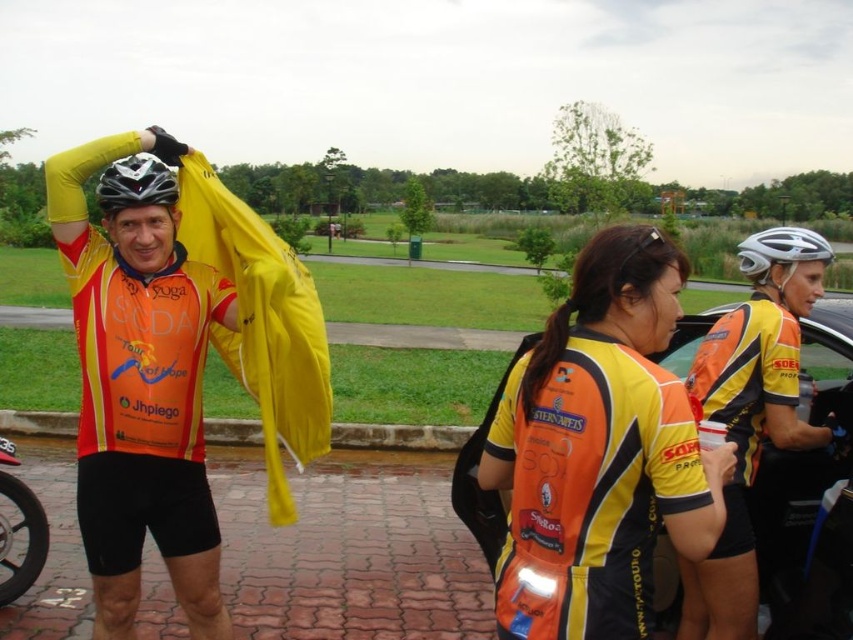
Does point (7, 582) come closer to viewer compared to point (141, 188)?

No, (7, 582) is behind (141, 188).

Can you confirm if black rubber tire at lower left is positioned above matte black helmet at upper left?

No, black rubber tire at lower left is not above matte black helmet at upper left.

Locate an element on the screen. black rubber tire at lower left is located at coordinates (26, 540).

Between yellow-orange cycling jersey at center and black rubber tire at lower left, which one is positioned higher?

yellow-orange cycling jersey at center is above.

Does yellow-orange cycling jersey at center appear on the right side of black rubber tire at lower left?

Yes, yellow-orange cycling jersey at center is to the right of black rubber tire at lower left.

At what (x,y) coordinates should I click in order to perform the action: click on yellow-orange cycling jersey at center. Please return your answer as a coordinate pair (x, y). Looking at the image, I should click on (599, 451).

Consider the image. Can you confirm if matte yellow jacket at center is bigger than orange jersey at center?

Yes, matte yellow jacket at center is bigger than orange jersey at center.

Is matte yellow jacket at center further to camera compared to orange jersey at center?

No, matte yellow jacket at center is in front of orange jersey at center.

Where is `matte yellow jacket at center`? This screenshot has height=640, width=853. matte yellow jacket at center is located at coordinates (138, 394).

Find the location of a particular element. matte yellow jacket at center is located at coordinates (138, 394).